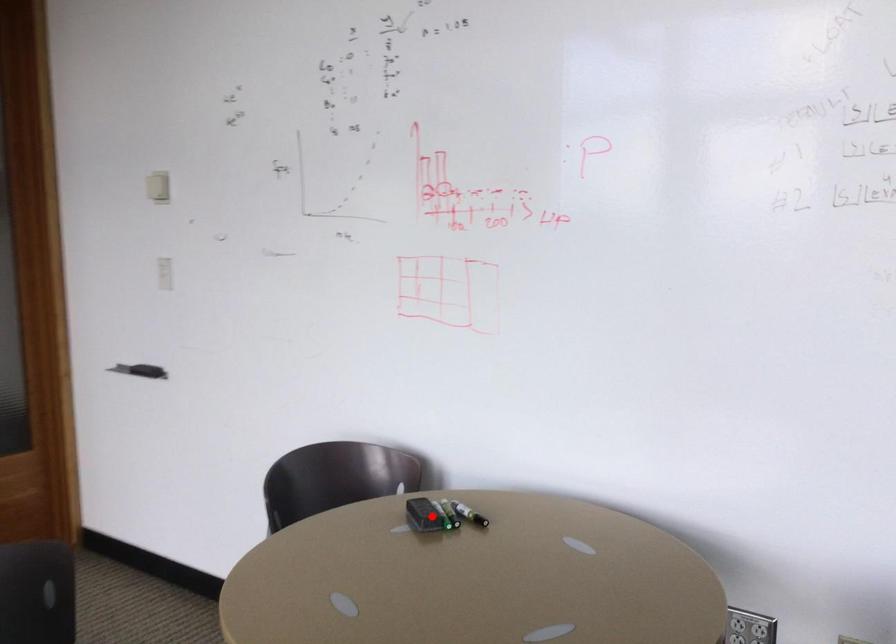
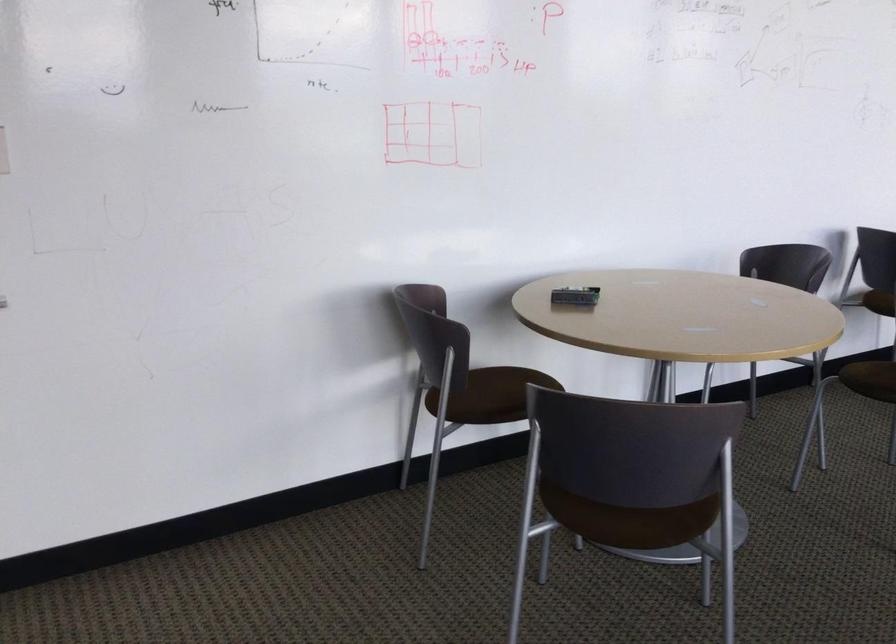
Question: I am providing you with two images of the same scene from different viewpoints. Image1 has a red point marked. In image2, the corresponding 3D location appears at what relative position? Reply with the corresponding letter.

Choices:
 (A) Closer
 (B) Farther

Answer: (B)